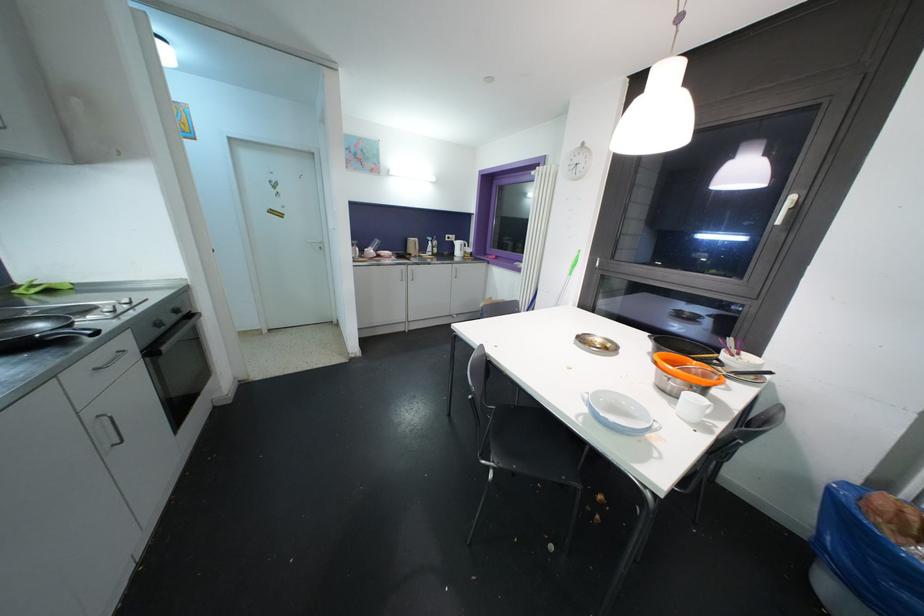
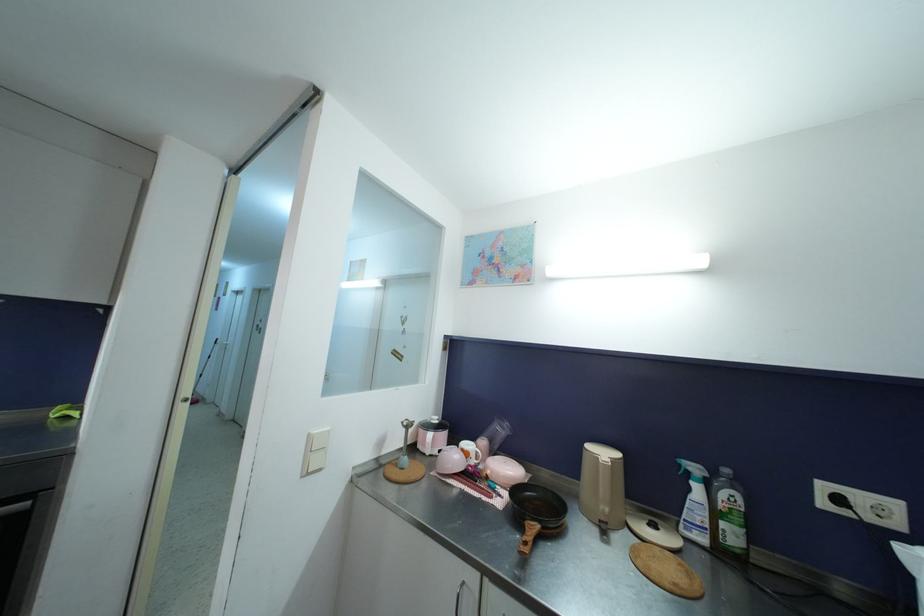
The point at [450,241] is marked in the first image. Where is the corresponding point in the second image?

(827, 507)